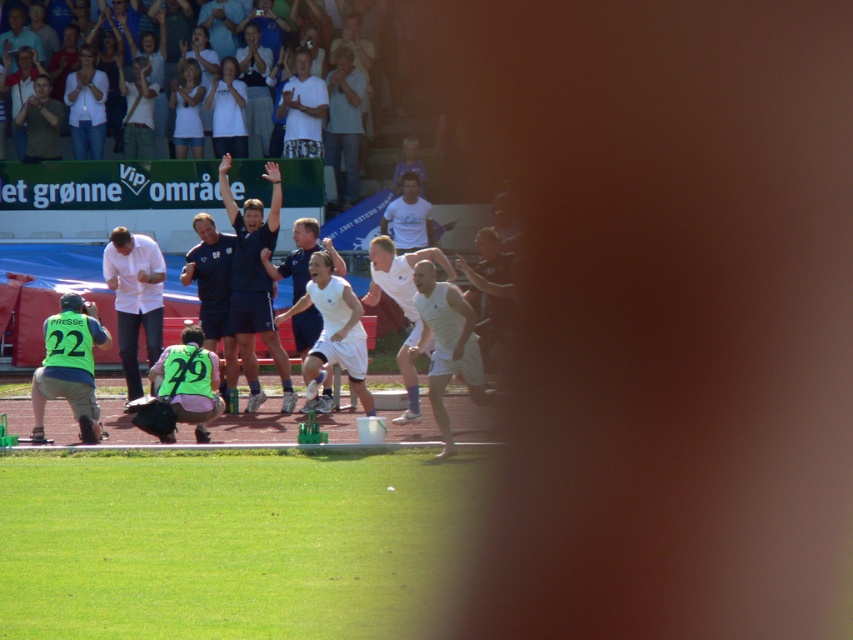
Is green grass football field at lower center bigger than dark blue uniform at center?

Actually, green grass football field at lower center might be smaller than dark blue uniform at center.

Can you confirm if green grass football field at lower center is shorter than dark blue uniform at center?

Yes.

Where is `green grass football field at lower center`? Image resolution: width=853 pixels, height=640 pixels. green grass football field at lower center is located at coordinates (225, 544).

Locate an element on the screen. green grass football field at lower center is located at coordinates (225, 544).

Who is shorter, neon green jersey at center or camouflage shirt at upper left?

neon green jersey at center

Is neon green jersey at center smaller than camouflage shirt at upper left?

No.

Is point (196, 365) positioned behind point (38, 157)?

No, it is in front of (38, 157).

This screenshot has height=640, width=853. I want to click on neon green jersey at center, so click(x=189, y=381).

Is white matte shirt at upper center behind camouflage shirt at upper left?

No, it is in front of camouflage shirt at upper left.

Is point (300, 80) closer to camera compared to point (53, 157)?

Yes, point (300, 80) is in front of point (53, 157).

What do you see at coordinates (302, 109) in the screenshot?
I see `white matte shirt at upper center` at bounding box center [302, 109].

Where is `white matte shirt at upper center`? This screenshot has width=853, height=640. white matte shirt at upper center is located at coordinates (302, 109).